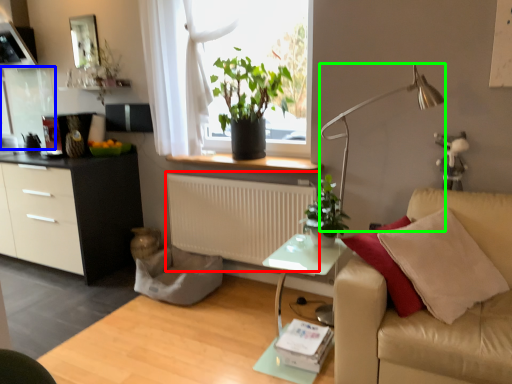
Question: Which is farther away from radiator (highlighted by a red box)? glass door (highlighted by a blue box) or lamp (highlighted by a green box)?

Choices:
 (A) glass door
 (B) lamp

Answer: (A)